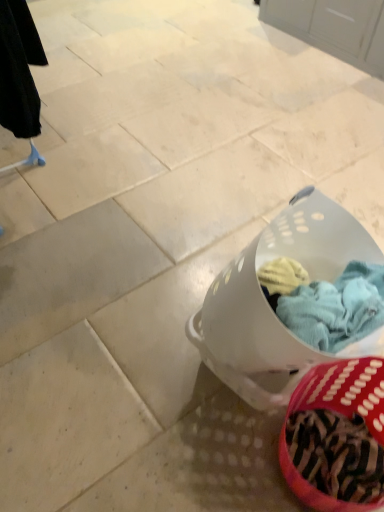
Question: In terms of width, does white plastic laundry basket at lower right look wider or thinner when compared to zebra-patterned fabric basket at lower right?

Choices:
 (A) thin
 (B) wide

Answer: (B)

Question: In terms of size, does white plastic laundry basket at lower right appear bigger or smaller than zebra-patterned fabric basket at lower right?

Choices:
 (A) small
 (B) big

Answer: (B)

Question: Is white plastic laundry basket at lower right taller or shorter than zebra-patterned fabric basket at lower right?

Choices:
 (A) tall
 (B) short

Answer: (A)

Question: In terms of size, does zebra-patterned fabric basket at lower right appear bigger or smaller than white plastic laundry basket at lower right?

Choices:
 (A) big
 (B) small

Answer: (B)

Question: In terms of height, does zebra-patterned fabric basket at lower right look taller or shorter compared to white plastic laundry basket at lower right?

Choices:
 (A) short
 (B) tall

Answer: (A)

Question: Relative to white plastic laundry basket at lower right, is zebra-patterned fabric basket at lower right in front or behind?

Choices:
 (A) front
 (B) behind

Answer: (A)

Question: Would you say zebra-patterned fabric basket at lower right is inside or outside white plastic laundry basket at lower right?

Choices:
 (A) outside
 (B) inside

Answer: (A)